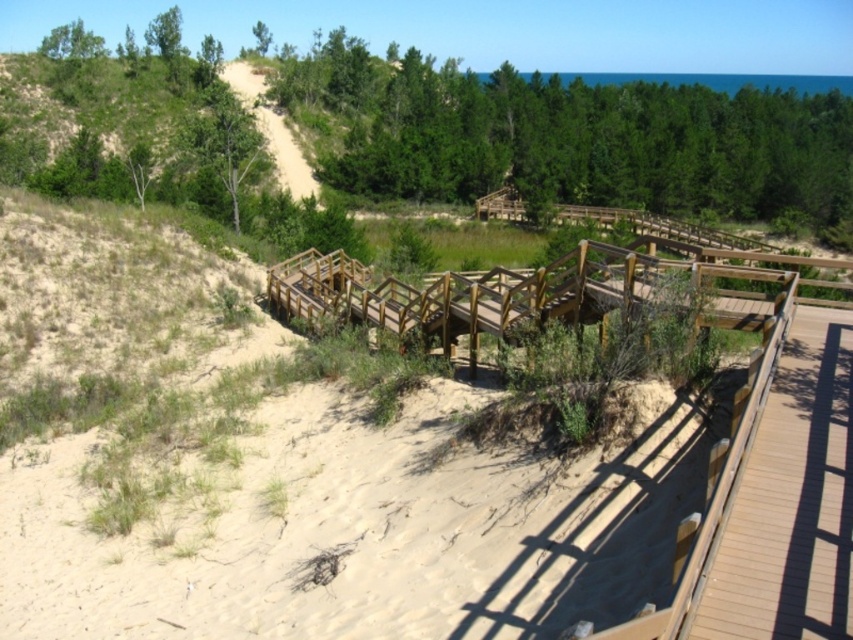
Question: Does light brown sandy path at center appear over smooth sand path at upper left?

Choices:
 (A) yes
 (B) no

Answer: (B)

Question: Can you confirm if brown wood boardwalk at right is bigger than wooden stairs at center?

Choices:
 (A) no
 (B) yes

Answer: (A)

Question: Among these objects, which one is farthest from the camera?

Choices:
 (A) brown wood boardwalk at right
 (B) smooth sand path at upper left

Answer: (B)

Question: Which point is farther from the camera taking this photo?

Choices:
 (A) (795, 554)
 (B) (433, 618)

Answer: (B)

Question: Which point appears farthest from the camera in this image?

Choices:
 (A) (283, 148)
 (B) (131, 621)

Answer: (A)

Question: Can you confirm if light brown sandy path at center is smaller than wooden stairs at center?

Choices:
 (A) no
 (B) yes

Answer: (A)